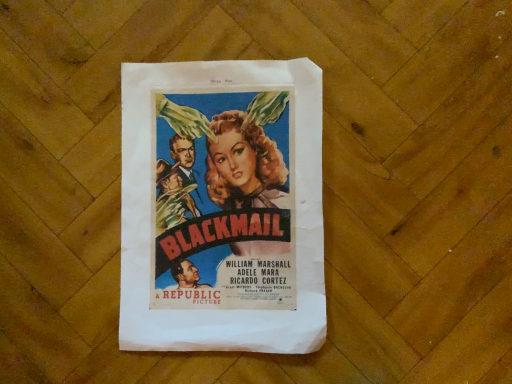
What are the coordinates of `empty space that is ontop of matte paper poster at center (from a real-world perspective)` in the screenshot? It's located at (218, 204).